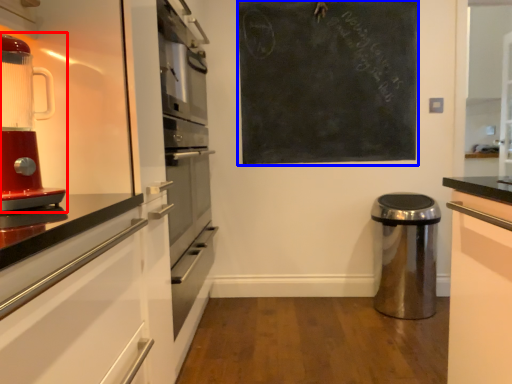
Question: Which of the following is the farthest to the observer, home appliance (highlighted by a red box) or bulletin board (highlighted by a blue box)?

Choices:
 (A) home appliance
 (B) bulletin board

Answer: (B)